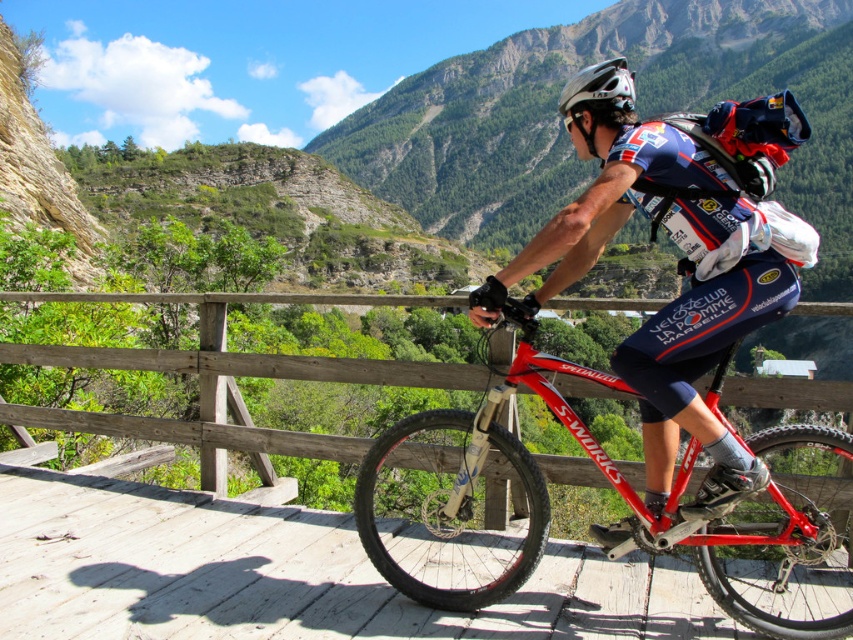
Between point (697, 561) and point (610, 93), which one is positioned in front?

Positioned in front is point (697, 561).

Does point (815, 428) lie in front of point (610, 68)?

That is True.

Where is `shiny red frame at center`? shiny red frame at center is located at coordinates (474, 492).

Is shiny red frame at center wider than red matte bicycle at center?

Correct, the width of shiny red frame at center exceeds that of red matte bicycle at center.

Image resolution: width=853 pixels, height=640 pixels. What do you see at coordinates (474, 492) in the screenshot?
I see `shiny red frame at center` at bounding box center [474, 492].

Is point (837, 598) closer to camera compared to point (541, 304)?

Yes, point (837, 598) is closer to viewer.

Where is `shiny red frame at center`? shiny red frame at center is located at coordinates (474, 492).

Which is above, red matte bicycle at center or white matte helmet at upper center?

white matte helmet at upper center is above.

Find the location of a particular element. Image resolution: width=853 pixels, height=640 pixels. red matte bicycle at center is located at coordinates (677, 269).

Identify the location of red matte bicycle at center. The width and height of the screenshot is (853, 640). (677, 269).

Where is `red matte bicycle at center`? The image size is (853, 640). red matte bicycle at center is located at coordinates (677, 269).